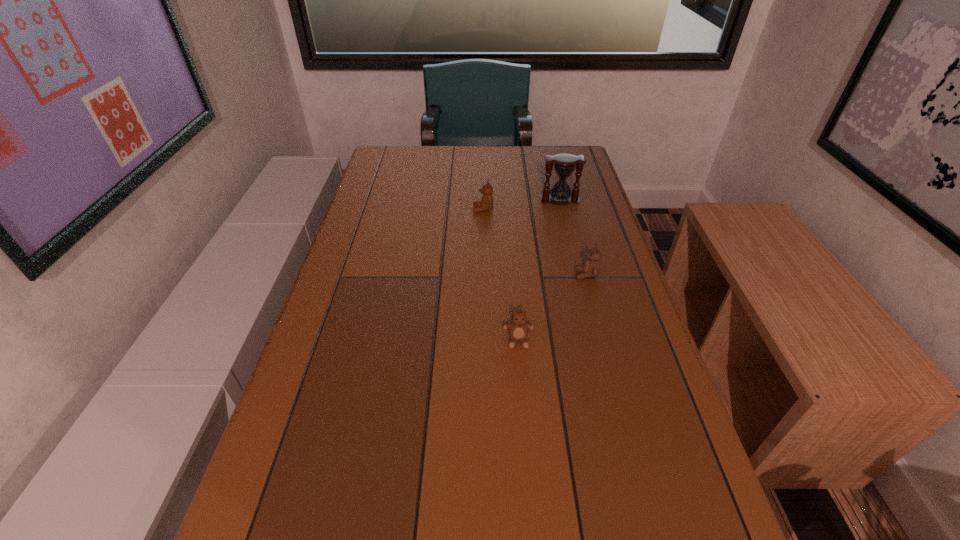
The image size is (960, 540). In order to click on vacant region between the tallest object and the rightmost teddy bear in this screenshot , I will do `click(573, 237)`.

Where is `free space that is in between the second farthest teddy bear and the tallest object`? This screenshot has width=960, height=540. free space that is in between the second farthest teddy bear and the tallest object is located at coordinates (573, 237).

Where is `vacant point located between the tallest object and the nearest teddy bear`? The width and height of the screenshot is (960, 540). vacant point located between the tallest object and the nearest teddy bear is located at coordinates (539, 270).

Locate an element on the screen. vacant point located between the second nearest object and the farthest teddy bear is located at coordinates (535, 242).

At what (x,y) coordinates should I click in order to perform the action: click on vacant area that lies between the third object from right to left and the hourglass. Please return your answer as a coordinate pair (x, y). This screenshot has height=540, width=960. Looking at the image, I should click on (539, 270).

The image size is (960, 540). I want to click on empty space that is in between the rightmost teddy bear and the hourglass, so [x=573, y=237].

At what (x,y) coordinates should I click in order to perform the action: click on free space between the second nearest teddy bear and the farthest teddy bear. Please return your answer as a coordinate pair (x, y). The height and width of the screenshot is (540, 960). Looking at the image, I should click on (535, 242).

I want to click on vacant point located between the nearest teddy bear and the third farthest object, so click(x=552, y=308).

Find the location of `free space between the hourglass and the second farthest teddy bear`. free space between the hourglass and the second farthest teddy bear is located at coordinates (573, 237).

What are the coordinates of `vacant area that lies between the second teddy bear from left to right and the second farthest teddy bear` in the screenshot? It's located at (552, 308).